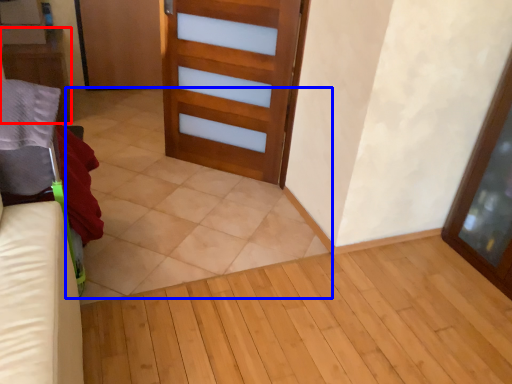
Question: Which of the following is the farthest to the observer, furniture (highlighted by a red box) or tile (highlighted by a blue box)?

Choices:
 (A) furniture
 (B) tile

Answer: (A)